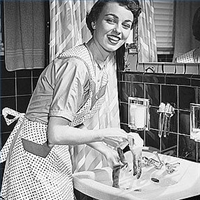
Locate an element on the screen. woman partially reflected in mirror is located at coordinates (198, 23).